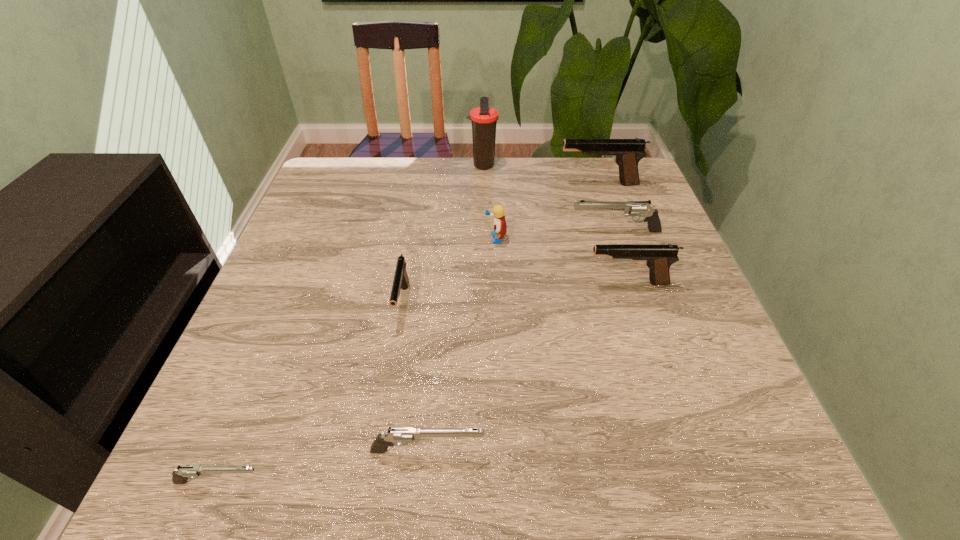
Find the location of a particular element. thermos bottle is located at coordinates (484, 118).

Locate an element on the screen. The width and height of the screenshot is (960, 540). the farthest object is located at coordinates (484, 118).

Find the location of a particular element. the biggest black pistol is located at coordinates (627, 153).

I want to click on the farthest pistol, so click(627, 153).

The image size is (960, 540). I want to click on the second tallest pistol, so click(x=658, y=258).

The height and width of the screenshot is (540, 960). In order to click on Lego in this screenshot , I will do `click(500, 228)`.

Locate an element on the screen. This screenshot has width=960, height=540. the farthest silver pistol is located at coordinates (632, 209).

This screenshot has height=540, width=960. Identify the location of the fifth nearest pistol. (632, 209).

In order to click on the leftmost black pistol in this screenshot , I will do `click(401, 280)`.

Where is `the fifth farthest pistol`? The width and height of the screenshot is (960, 540). the fifth farthest pistol is located at coordinates (399, 436).